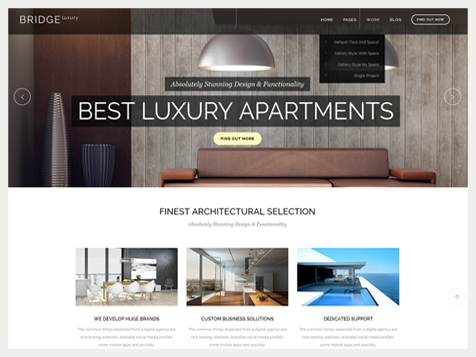
Find the location of `couch/lounge sweet`. couch/lounge sweet is located at coordinates (277, 180).